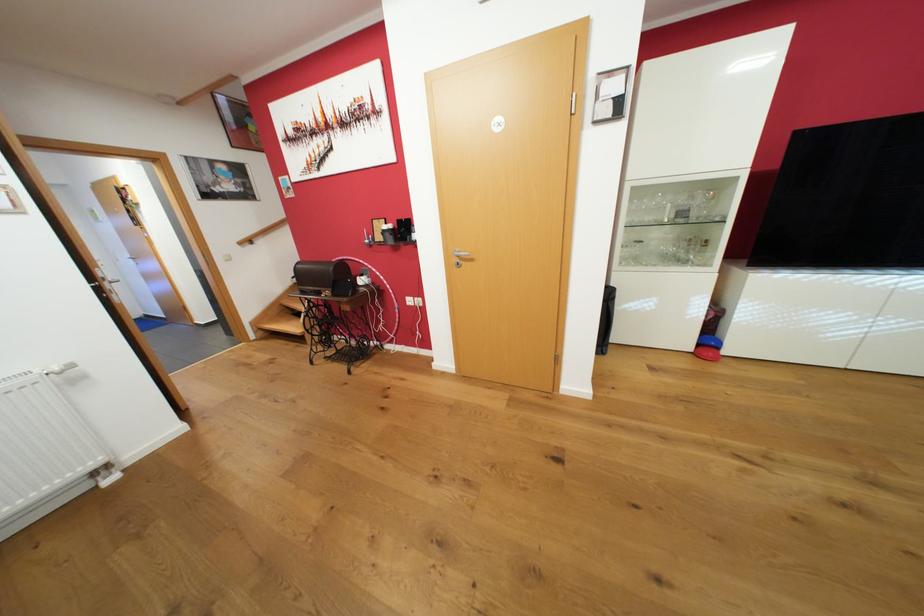
Describe the element at coordinates (59, 369) in the screenshot. I see `the radiator valve` at that location.